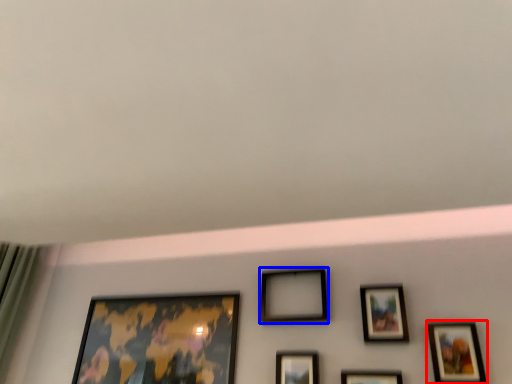
Question: Which object is closer to the camera taking this photo, picture frame (highlighted by a red box) or picture frame (highlighted by a blue box)?

Choices:
 (A) picture frame
 (B) picture frame

Answer: (A)